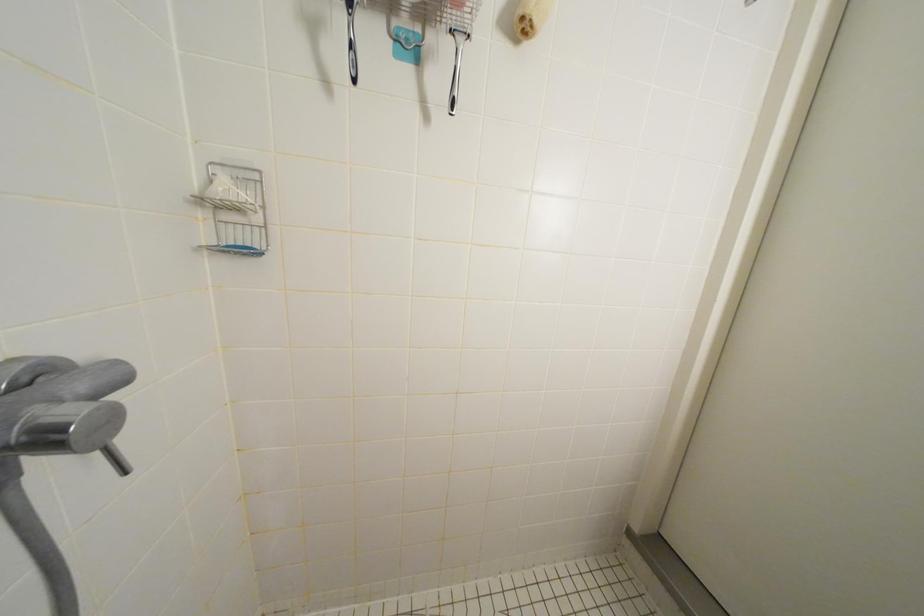
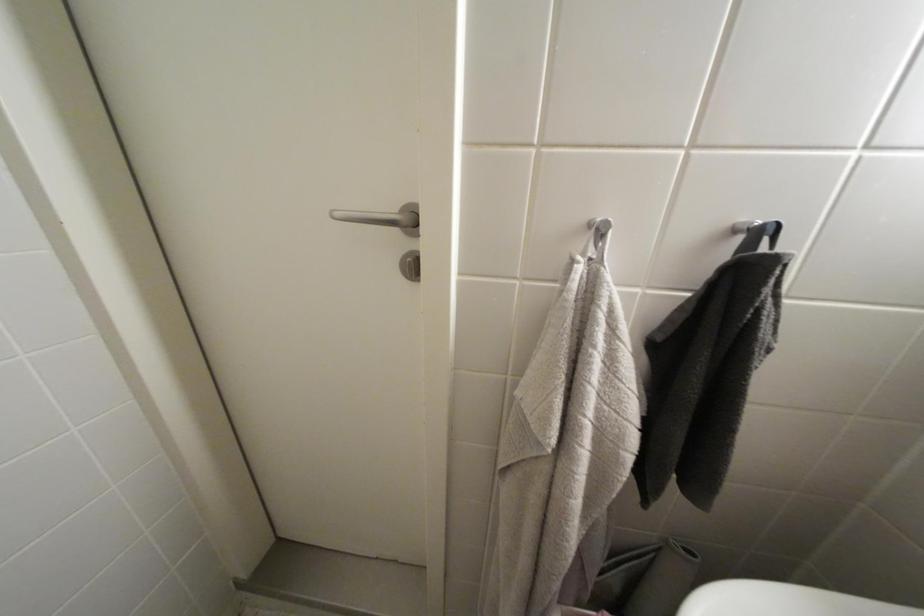
Consider the image. The images are taken continuously from a first-person perspective. In which direction is your viewpoint rotating?

The camera's rotation is toward right-down.